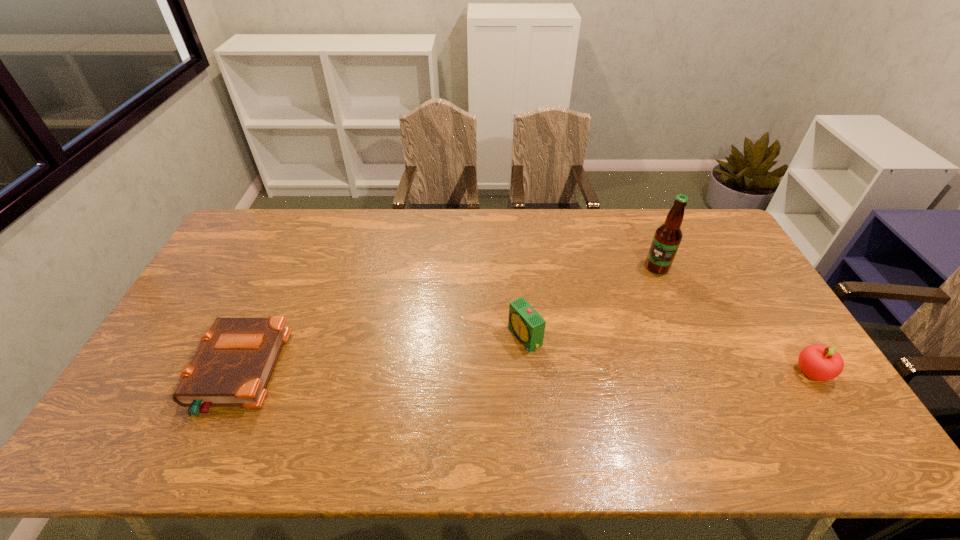
Locate an element on the screen. free space between the Bible and the apple is located at coordinates (525, 372).

This screenshot has width=960, height=540. In order to click on vacant region between the Bible and the alarm clock in this screenshot , I will do tap(381, 354).

Locate an element on the screen. The image size is (960, 540). vacant space in between the alarm clock and the second object from right to left is located at coordinates (591, 302).

The width and height of the screenshot is (960, 540). I want to click on vacant area between the third object from left to right and the Bible, so click(x=447, y=320).

This screenshot has height=540, width=960. In order to click on vacant space that is in between the alarm clock and the tallest object in this screenshot , I will do pyautogui.click(x=591, y=302).

Where is `free spot between the second object from right to left and the rightmost object`? The height and width of the screenshot is (540, 960). free spot between the second object from right to left and the rightmost object is located at coordinates (734, 320).

This screenshot has height=540, width=960. Find the location of `free space between the alarm clock and the apple`. free space between the alarm clock and the apple is located at coordinates point(668,355).

Select which object is the third closest to the third object from right to left. Please provide its 2D coordinates. Your answer should be formatted as a tuple, i.e. [(x, y)], where the tuple contains the x and y coordinates of a point satisfying the conditions above.

[(819, 362)]

Identify the location of the third closest object to the rightmost object. (233, 366).

Image resolution: width=960 pixels, height=540 pixels. Identify the location of free spot that satisfies the following two spatial constraints: 1. on the front side of the apple; 2. on the right side of the alarm clock. click(x=528, y=373).